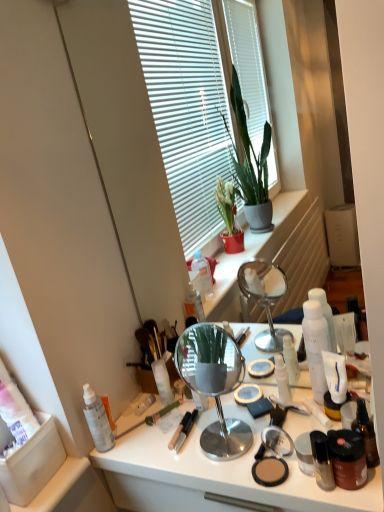
This screenshot has width=384, height=512. What are the coordinates of `free space behind polished silver mirror at center` in the screenshot? It's located at (226, 404).